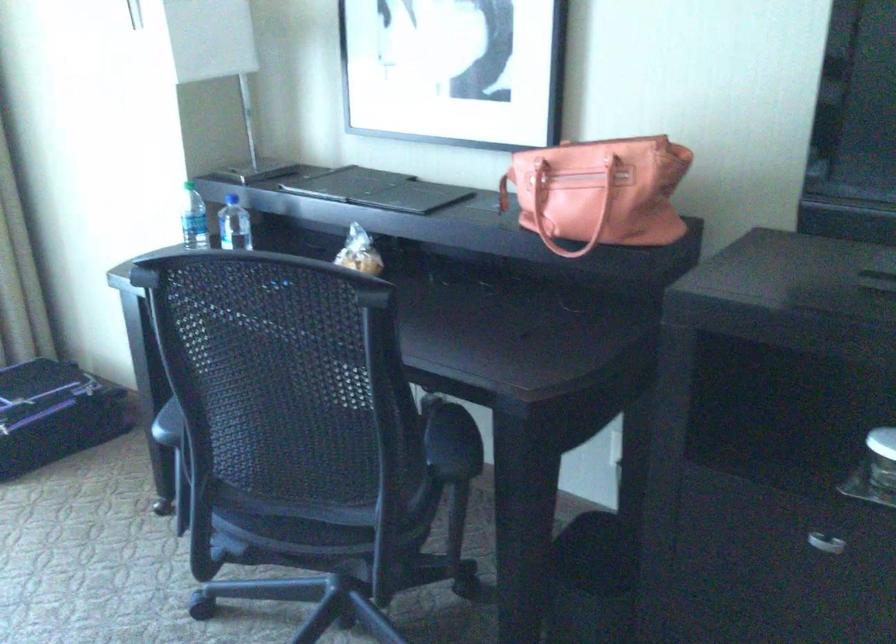
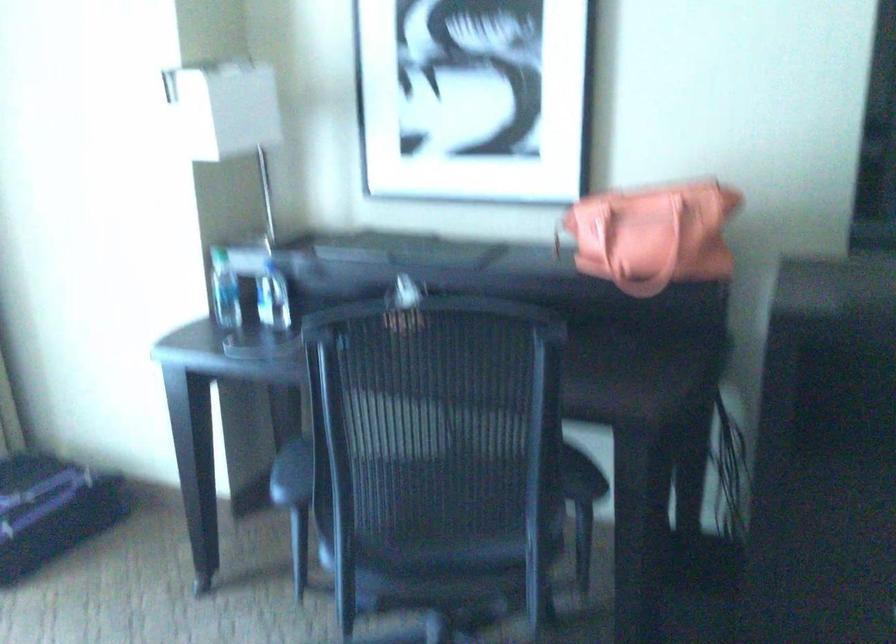
Question: What movement of the cameraman would produce the second image?

Choices:
 (A) Left
 (B) Right
 (C) Forward
 (D) Backward

Answer: (A)